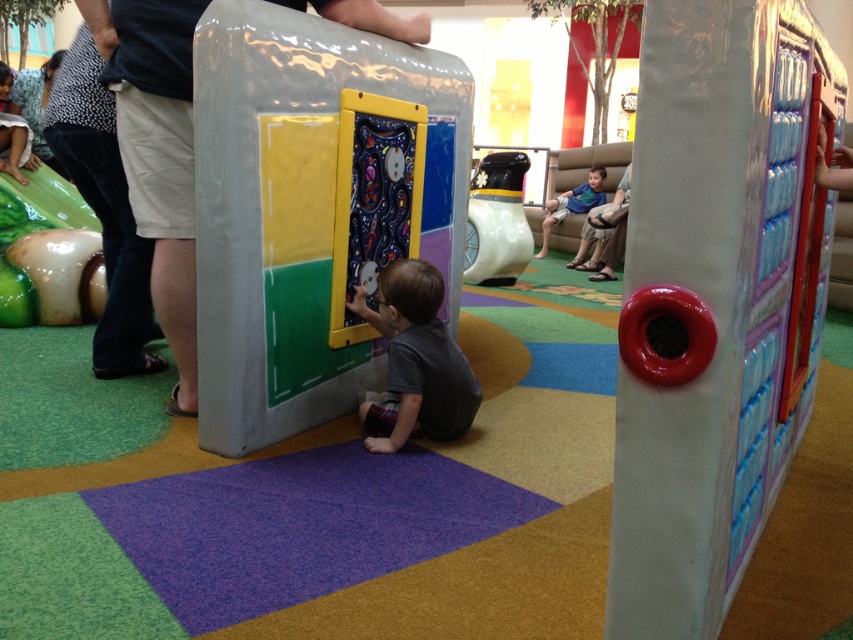
Question: Estimate the real-world distances between objects in this image. Which object is closer to the shiny plastic mushroom at lower left?

Choices:
 (A) white glossy toy at center
 (B) gray matte shirt at center
 (C) dark gray pants at left

Answer: (C)

Question: Among these points, which one is nearest to the camera?

Choices:
 (A) (469, 188)
 (B) (88, 218)

Answer: (B)

Question: Does smooth plastic door at center have a smaller size compared to light gray shorts at left?

Choices:
 (A) yes
 (B) no

Answer: (B)

Question: Which point appears closest to the camera in this image?

Choices:
 (A) (821, 80)
 (B) (114, 364)
 (C) (544, 224)

Answer: (A)

Question: From the image, what is the correct spatial relationship of shiny plastic mushroom at lower left in relation to blue cotton shirt at upper center?

Choices:
 (A) below
 (B) above

Answer: (A)

Question: Does smooth plastic door at center have a larger size compared to dark gray pants at left?

Choices:
 (A) no
 (B) yes

Answer: (B)